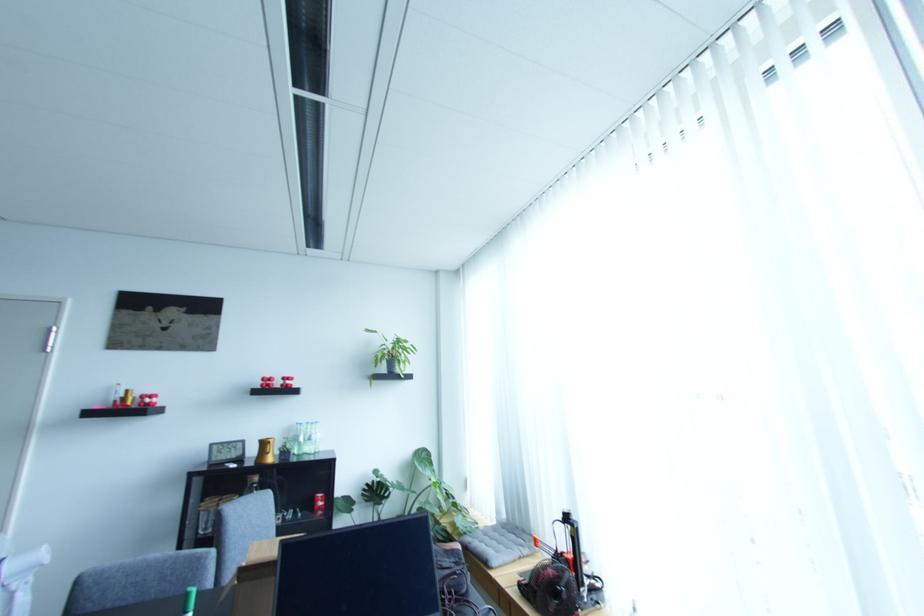
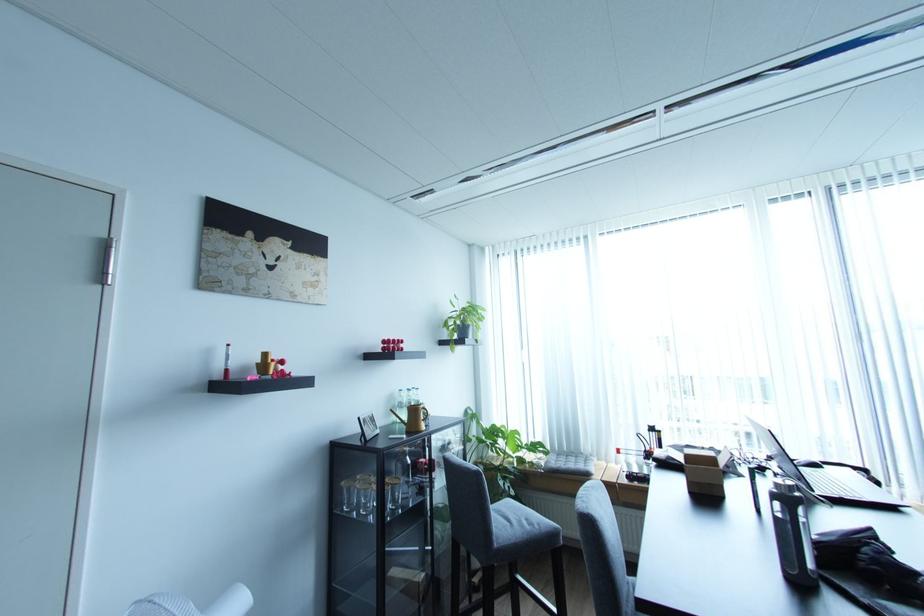
Find the pixel in the second image that matches point (273, 451) in the first image.

(426, 418)